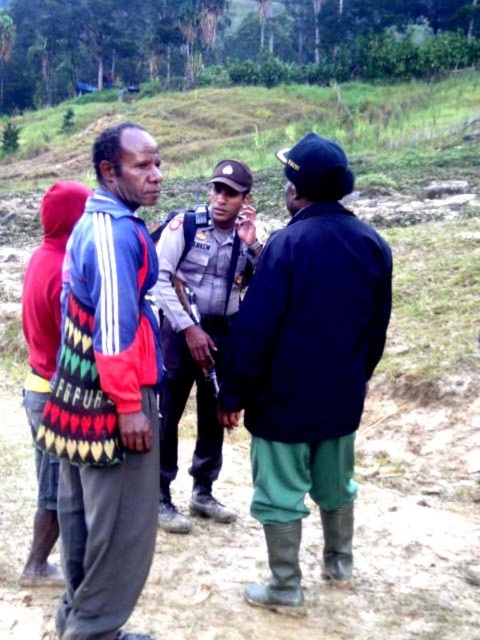
Can you confirm if dark blue jacket at center is positioned to the right of light gray uniform at center?

Indeed, dark blue jacket at center is positioned on the right side of light gray uniform at center.

Is dark blue jacket at center to the left of light gray uniform at center from the viewer's perspective?

No, dark blue jacket at center is not to the left of light gray uniform at center.

Is point (333, 276) positioned after point (216, 243)?

No, (333, 276) is in front of (216, 243).

Locate an element on the screen. The image size is (480, 640). dark blue jacket at center is located at coordinates (307, 364).

Is dirt field at center shorter than dark blue jacket at center?

Incorrect, dirt field at center's height does not fall short of dark blue jacket at center's.

Does dirt field at center come behind dark blue jacket at center?

No, it is not.

Is point (25, 541) more distant than point (257, 593)?

That is True.

This screenshot has width=480, height=640. Identify the location of dirt field at center. 365,483.

Can you confirm if knitted fabric bag at center is positioned above light gray uniform at center?

Yes.

Is point (122, 376) behind point (172, 241)?

No, it is not.

The image size is (480, 640). Describe the element at coordinates (108, 394) in the screenshot. I see `knitted fabric bag at center` at that location.

Locate an element on the screen. knitted fabric bag at center is located at coordinates (108, 394).